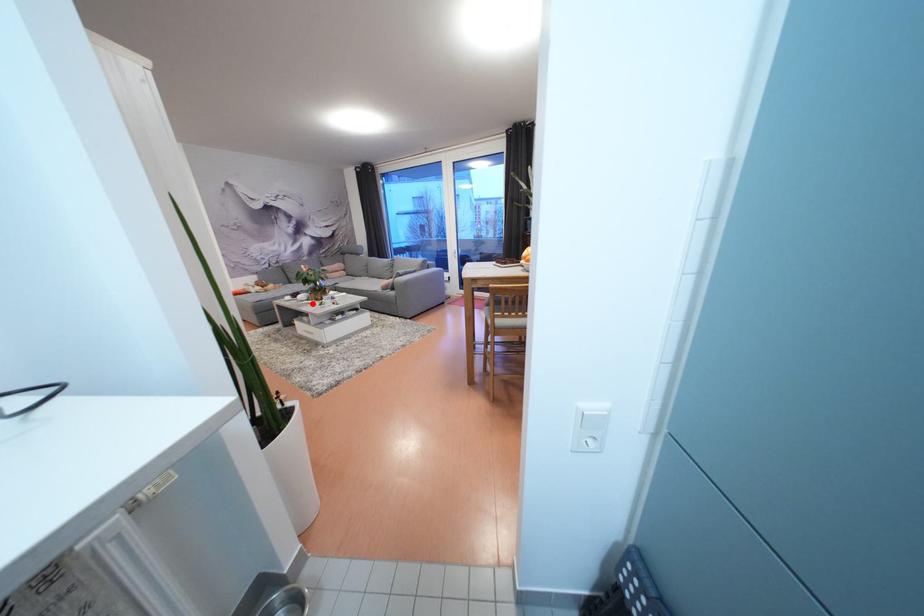
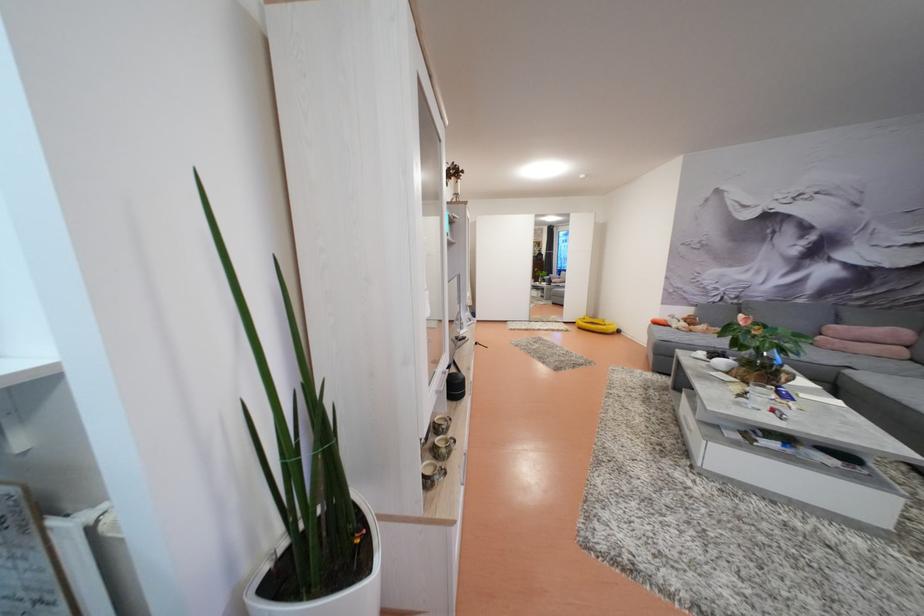
Find the pixel in the second image that matches the highlighted location in the first image.

(731, 374)